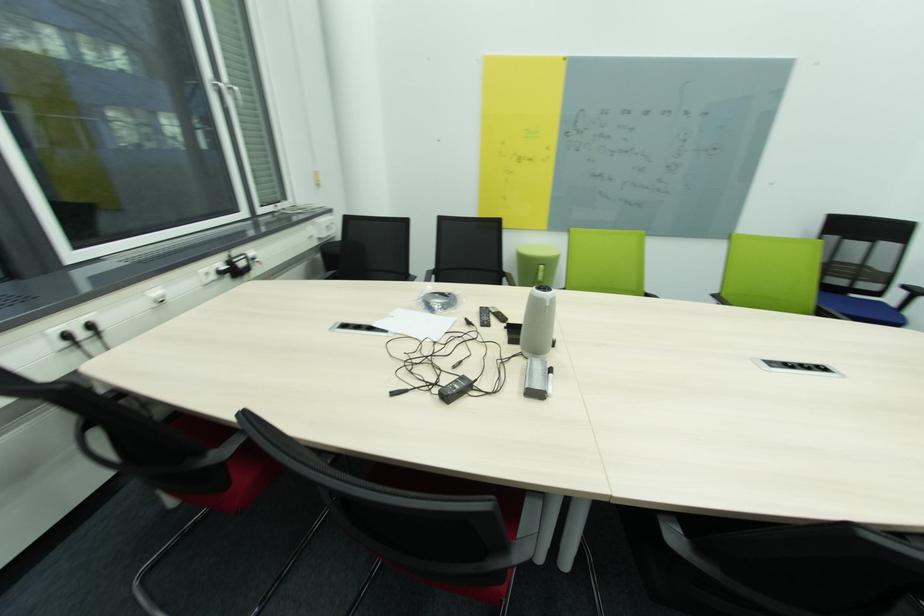
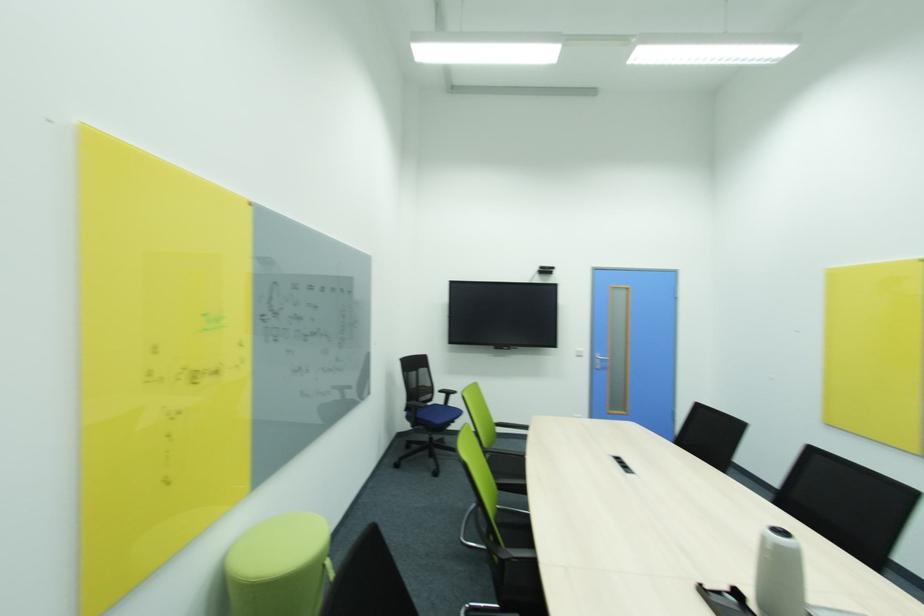
Locate, in the second image, the point that corresponds to point 892,246 in the first image.

(428, 371)